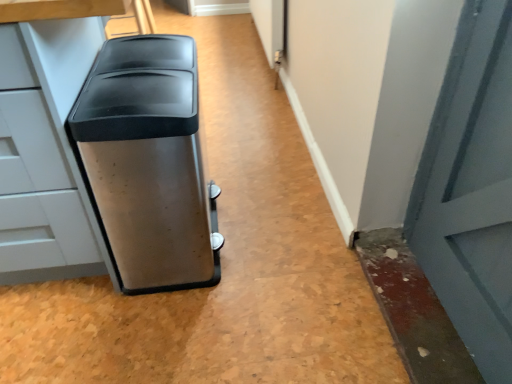
Question: Should I look upward or downward to see satin metallic trash can at left?

Choices:
 (A) up
 (B) down

Answer: (A)

Question: Could you tell me if satin metallic trash can at left is facing stainless steel trash can at center?

Choices:
 (A) yes
 (B) no

Answer: (B)

Question: Can you confirm if satin metallic trash can at left is wider than stainless steel trash can at center?

Choices:
 (A) yes
 (B) no

Answer: (A)

Question: Is satin metallic trash can at left next to stainless steel trash can at center and touching it?

Choices:
 (A) no
 (B) yes

Answer: (A)

Question: Is stainless steel trash can at center located within satin metallic trash can at left?

Choices:
 (A) no
 (B) yes

Answer: (B)

Question: From a real-world perspective, is satin metallic trash can at left on stainless steel trash can at center?

Choices:
 (A) yes
 (B) no

Answer: (A)

Question: From the image's perspective, does satin metallic trash can at left appear higher than stainless steel trash can at center?

Choices:
 (A) yes
 (B) no

Answer: (A)

Question: Considering the relative sizes of stainless steel trash can at center and satin metallic trash can at left in the image provided, is stainless steel trash can at center shorter than satin metallic trash can at left?

Choices:
 (A) no
 (B) yes

Answer: (B)

Question: Is stainless steel trash can at center turned away from satin metallic trash can at left?

Choices:
 (A) yes
 (B) no

Answer: (A)

Question: From a real-world perspective, is stainless steel trash can at center positioned over satin metallic trash can at left based on gravity?

Choices:
 (A) yes
 (B) no

Answer: (B)

Question: From a real-world perspective, is stainless steel trash can at center physically below satin metallic trash can at left?

Choices:
 (A) yes
 (B) no

Answer: (A)

Question: Is stainless steel trash can at center bigger than satin metallic trash can at left?

Choices:
 (A) no
 (B) yes

Answer: (A)

Question: From the image's perspective, is stainless steel trash can at center located beneath satin metallic trash can at left?

Choices:
 (A) yes
 (B) no

Answer: (A)

Question: Considering the positions of stainless steel trash can at center and satin metallic trash can at left in the image, is stainless steel trash can at center taller or shorter than satin metallic trash can at left?

Choices:
 (A) tall
 (B) short

Answer: (B)